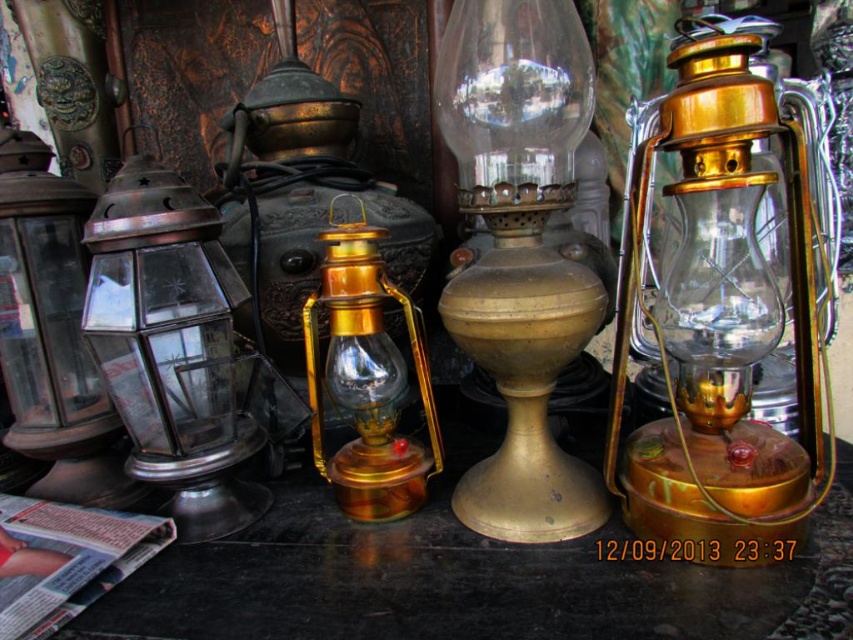
Question: Can you confirm if matte glass lantern at left is positioned below gold polished metal oil lamp at center?

Choices:
 (A) no
 (B) yes

Answer: (A)

Question: Which point is farther to the camera?

Choices:
 (A) (115, 477)
 (B) (837, 554)
 (C) (395, 365)
 (D) (140, 280)

Answer: (A)

Question: Which point is farther from the camera taking this photo?

Choices:
 (A) pos(91,490)
 (B) pos(763,429)

Answer: (A)

Question: Is gold brass oil lamp at center below matte glass lantern at left?

Choices:
 (A) no
 (B) yes

Answer: (A)

Question: Does gold polished metal lantern at center have a lesser width compared to gold polished metal oil lamp at center?

Choices:
 (A) no
 (B) yes

Answer: (A)

Question: Which of the following is the closest to the observer?

Choices:
 (A) matte glass lantern at left
 (B) gold polished metal lantern at center

Answer: (B)